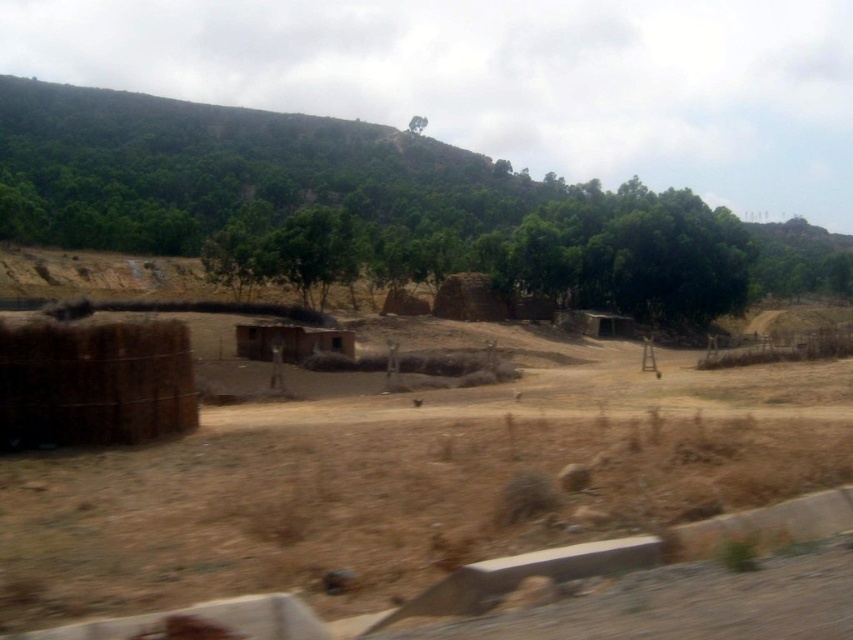
Question: Can you confirm if brown mud hut at center is positioned below brown matte train window at center?

Choices:
 (A) yes
 (B) no

Answer: (B)

Question: Among these points, which one is farthest from the camera?

Choices:
 (A) (292, 536)
 (B) (341, 348)
 (C) (260, 323)
 (D) (415, 125)

Answer: (D)

Question: Among these points, which one is nearest to the camera?

Choices:
 (A) (340, 337)
 (B) (309, 474)
 (C) (343, 348)

Answer: (B)

Question: From the image, what is the correct spatial relationship of brown dry dirt field at center in relation to green leafy tree at upper center?

Choices:
 (A) right
 (B) left

Answer: (A)

Question: Which point appears farthest from the camera in this image?

Choices:
 (A) (312, 326)
 (B) (412, 116)

Answer: (B)

Question: Can you confirm if brown mud hut at center is positioned to the right of brown matte train window at center?

Choices:
 (A) no
 (B) yes

Answer: (A)